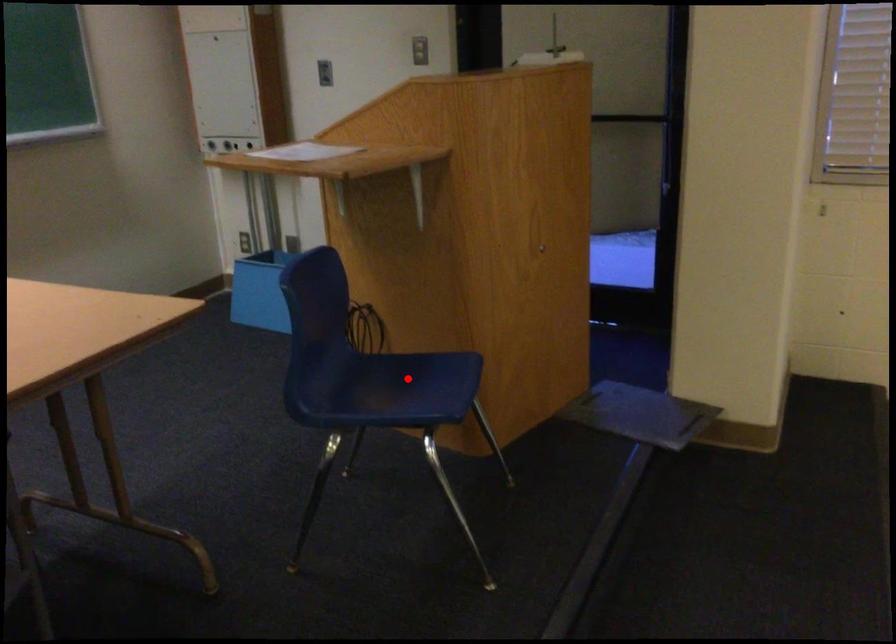
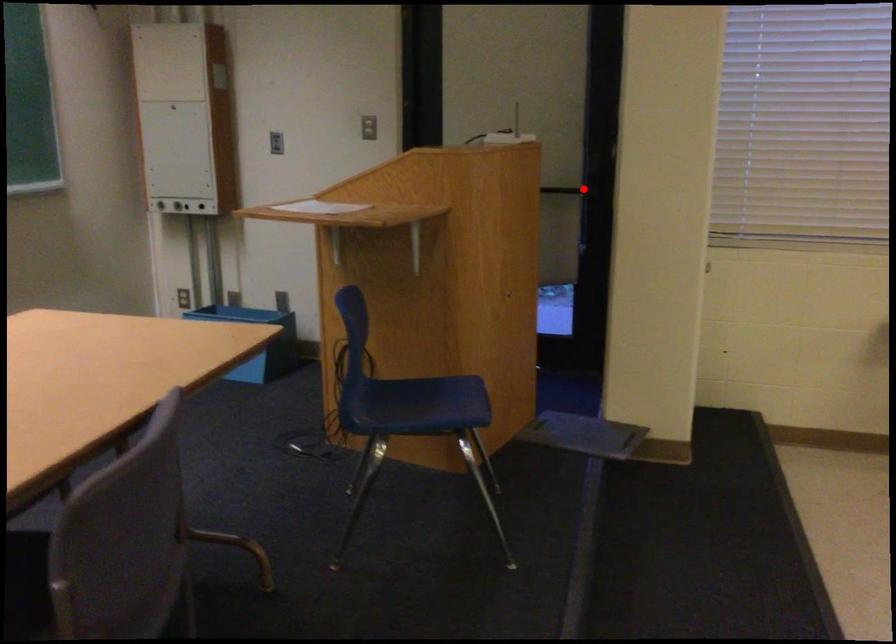
I am providing you with two images of the same scene from different viewpoints. A red point is marked on the first image and another point is marked on the second image. Do the highlighted points in image1 and image2 indicate the same real-world spot?

No